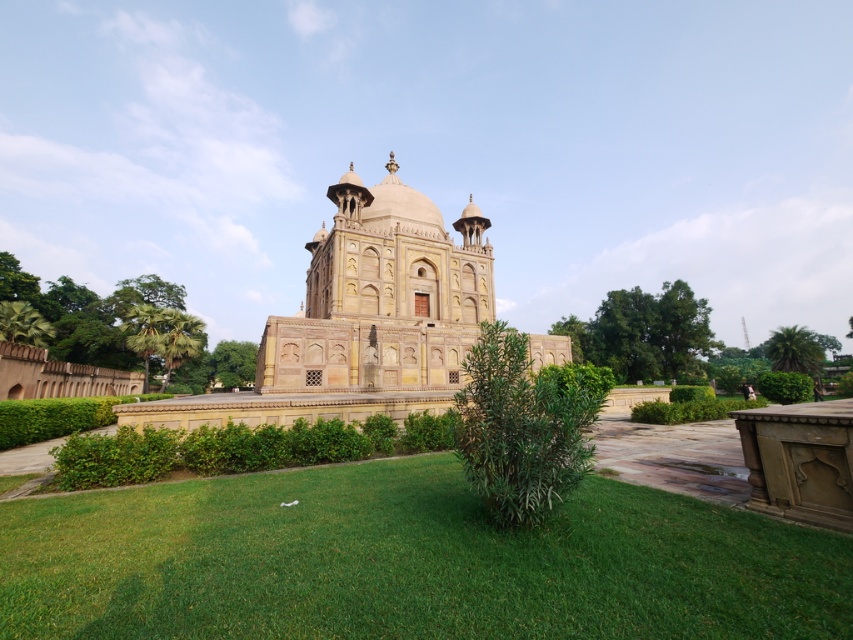
You are standing at the entrance of the monument and see two points marked in the image. The first point is at coordinates point (622,294), and the second is at point (247,342). If you want to walk towards the point that is closer to the monument, which coordinate should you head towards?

Point (622,294) is in front of point (247,342), so it is closer to the monument. Therefore, you should head towards point (622,294).

You are standing at the entrance of the monument and want to walk towards the green grass at center. What direction should you head in?

The green grass at center is located at coordinates point (408,563), so you should head towards the center of the image to reach it.